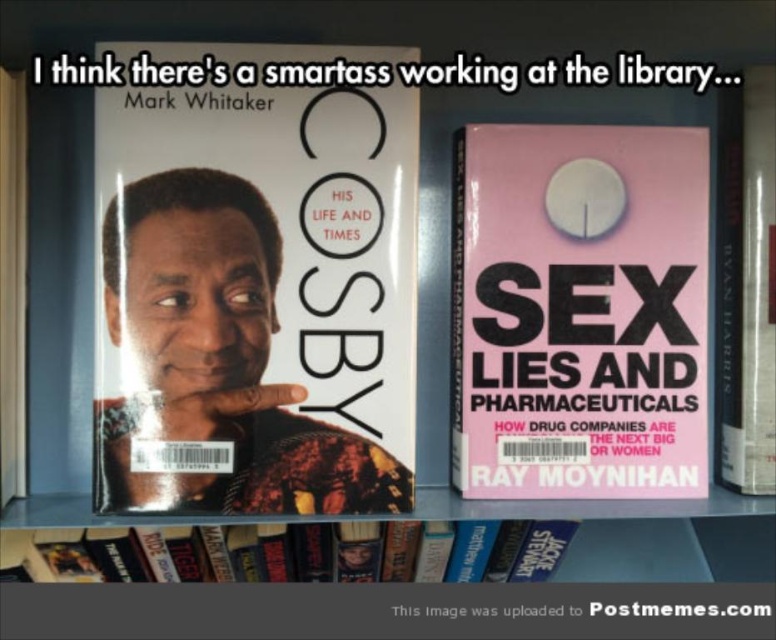
Between matte black book cover at center and pink matte book cover at center, which one appears on the right side from the viewer's perspective?

From the viewer's perspective, pink matte book cover at center appears more on the right side.

Based on the photo, is matte black book cover at center above pink matte book cover at center?

Indeed, matte black book cover at center is positioned over pink matte book cover at center.

Is point (248, 349) less distant than point (560, 154)?

Yes, point (248, 349) is in front of point (560, 154).

Identify the location of matte black book cover at center. The height and width of the screenshot is (640, 776). (255, 280).

Is point (139, 84) farther from viewer compared to point (771, 442)?

No, (139, 84) is in front of (771, 442).

Is matte black book cover at center further to the viewer compared to hardcover book at center?

No.

Locate an element on the screen. matte black book cover at center is located at coordinates (255, 280).

Can you confirm if pink matte book cover at center is shorter than hardcover book at center?

Yes, pink matte book cover at center is shorter than hardcover book at center.

Identify the location of pink matte book cover at center. (579, 312).

Identify the location of pink matte book cover at center. This screenshot has width=776, height=640. (579, 312).

Find the location of a particular element. The height and width of the screenshot is (640, 776). pink matte book cover at center is located at coordinates (579, 312).